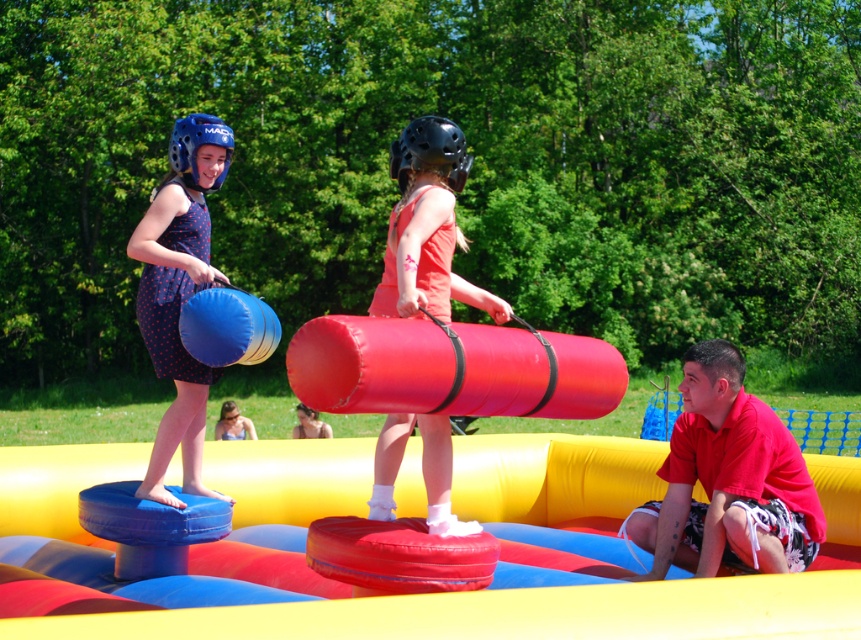
Does matte blue helmet at upper left have a larger size compared to smooth pink helmet at upper center?

No, matte blue helmet at upper left is not bigger than smooth pink helmet at upper center.

What are the coordinates of `matte blue helmet at upper left` in the screenshot? It's located at (233, 422).

Image resolution: width=861 pixels, height=640 pixels. What are the coordinates of `blue dotted dress at upper left` in the screenshot? It's located at click(x=178, y=292).

Based on the photo, is blue dotted dress at upper left smaller than matte blue helmet at upper left?

Actually, blue dotted dress at upper left might be larger than matte blue helmet at upper left.

Where is `blue dotted dress at upper left`? blue dotted dress at upper left is located at coordinates (178, 292).

Where is `blue dotted dress at upper left`? Image resolution: width=861 pixels, height=640 pixels. blue dotted dress at upper left is located at coordinates (178, 292).

Can you confirm if black matte helmet at center is positioned to the left of smooth pink helmet at upper center?

Incorrect, black matte helmet at center is not on the left side of smooth pink helmet at upper center.

Is black matte helmet at center above smooth pink helmet at upper center?

Yes.

Which is in front, point (407, 156) or point (296, 413)?

Point (407, 156)

In order to click on black matte helmet at center in this screenshot , I will do `click(430, 150)`.